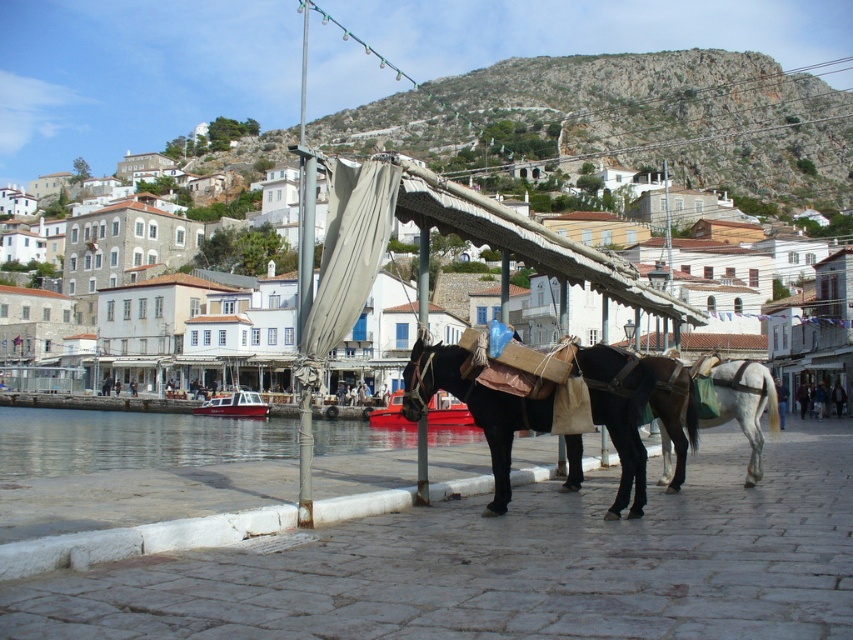
You are standing at the entrance of the cobblestone walkway in the coastal scene. You need to reach the black glossy horse at center to feed it. Which direction should you head towards from your current position?

The black glossy horse at center is located at point (x=637, y=412), so you should head towards the center of the image to reach it.

You are a tourist standing on the cobblestone walkway in front of the two horses. You want to take a photo that includes both the black glossy horse at center and the white glossy horse at right. If your camera can capture a maximum distance of 15 feet between subjects, will you be able to include both horses in the same frame?

The black glossy horse at center is 15.43 feet away from the white glossy horse at right. Since the camera can only capture up to 15 feet between subjects, the distance between them exceeds the camera range. Therefore, you cannot include both horses in the same frame.

You are a tourist standing on the cobblestone walkway and want to take a photo of the white glossy horse at right and the clear water at lower left. Which object will occupy more space in your photo?

The clear water at lower left will occupy more space in your photo because it has a larger size compared to the white glossy horse at right.